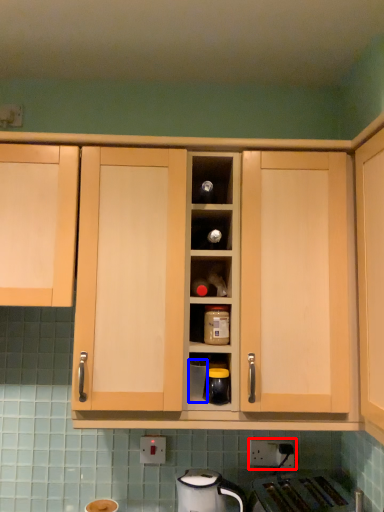
Question: Which object is closer to the camera taking this photo, electric outlet (highlighted by a red box) or appliance (highlighted by a blue box)?

Choices:
 (A) electric outlet
 (B) appliance

Answer: (B)